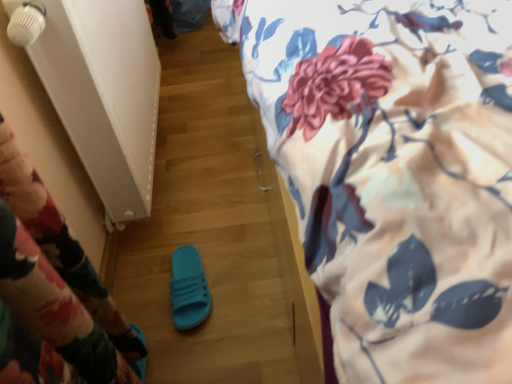
The height and width of the screenshot is (384, 512). Describe the element at coordinates (188, 289) in the screenshot. I see `teal rubber slipper at center` at that location.

Measure the distance between point (198, 324) and camera.

The distance of point (198, 324) from camera is 3.45 feet.

What is the approximate height of teal rubber slipper at center?

The height of teal rubber slipper at center is 5.65 centimeters.

Where is `teal rubber slipper at center`? This screenshot has width=512, height=384. teal rubber slipper at center is located at coordinates (188, 289).

The width and height of the screenshot is (512, 384). What do you see at coordinates (394, 173) in the screenshot? I see `floral fabric bed at upper right` at bounding box center [394, 173].

At what (x,y) coordinates should I click in order to perform the action: click on floral fabric bed at upper right. Please return your answer as a coordinate pair (x, y). The image size is (512, 384). Looking at the image, I should click on (394, 173).

Measure the distance between floral fabric bed at upper right and camera.

12.20 inches.

Find the location of a particular element. This screenshot has width=512, height=384. teal rubber slipper at center is located at coordinates (188, 289).

Can you confirm if floral fabric bed at upper right is positioned to the left of teal rubber slipper at center?

No.

Is floral fabric bed at upper right closer to the viewer compared to teal rubber slipper at center?

Yes, floral fabric bed at upper right is closer to the viewer.

Is point (323, 176) positioned in front of point (183, 250)?

Yes, point (323, 176) is in front of point (183, 250).

From the image's perspective, does floral fabric bed at upper right appear higher than teal rubber slipper at center?

Correct, floral fabric bed at upper right appears higher than teal rubber slipper at center in the image.

In the scene shown: From a real-world perspective, is floral fabric bed at upper right positioned above or below teal rubber slipper at center?

Clearly, from a real-world perspective, floral fabric bed at upper right is above teal rubber slipper at center.

Considering the sizes of floral fabric bed at upper right and teal rubber slipper at center in the image, is floral fabric bed at upper right wider or thinner than teal rubber slipper at center?

Clearly, floral fabric bed at upper right has more width compared to teal rubber slipper at center.

Considering the sizes of floral fabric bed at upper right and teal rubber slipper at center in the image, is floral fabric bed at upper right taller or shorter than teal rubber slipper at center?

floral fabric bed at upper right is taller than teal rubber slipper at center.

Who is smaller, floral fabric bed at upper right or teal rubber slipper at center?

With smaller size is teal rubber slipper at center.

Is floral fabric bed at upper right inside or outside of teal rubber slipper at center?

The correct answer is: outside.

Is floral fabric bed at upper right far from teal rubber slipper at center?

floral fabric bed at upper right is actually quite close to teal rubber slipper at center.

Is floral fabric bed at upper right oriented towards teal rubber slipper at center?

No, floral fabric bed at upper right does not turn towards teal rubber slipper at center.

Locate an element on the screen. This screenshot has width=512, height=384. bed located above the teal rubber slipper at center (from a real-world perspective) is located at coordinates (394, 173).

Would you say teal rubber slipper at center is to the left or to the right of floral fabric bed at upper right in the picture?

From the image, it's evident that teal rubber slipper at center is to the left of floral fabric bed at upper right.

Is teal rubber slipper at center in front of or behind floral fabric bed at upper right in the image?

teal rubber slipper at center is positioned farther from the viewer than floral fabric bed at upper right.

Considering the points (177, 267) and (421, 238), which point is in front, point (177, 267) or point (421, 238)?

The point (421, 238) is in front.

From the image's perspective, is teal rubber slipper at center located beneath floral fabric bed at upper right?

Yes.

From a real-world perspective, between teal rubber slipper at center and floral fabric bed at upper right, who is vertically lower?

teal rubber slipper at center.

Which of these two, teal rubber slipper at center or floral fabric bed at upper right, is thinner?

Thinner between the two is teal rubber slipper at center.

Looking at this image, can you confirm if teal rubber slipper at center is shorter than floral fabric bed at upper right?

Yes.

Which of these two, teal rubber slipper at center or floral fabric bed at upper right, is smaller?

teal rubber slipper at center.

In the scene shown: Is teal rubber slipper at center inside the boundaries of floral fabric bed at upper right, or outside?

teal rubber slipper at center lies outside floral fabric bed at upper right.

Would you say teal rubber slipper at center is a long distance from floral fabric bed at upper right?

That's not correct — teal rubber slipper at center is a little close to floral fabric bed at upper right.

Is teal rubber slipper at center facing towards floral fabric bed at upper right?

No, teal rubber slipper at center is not aimed at floral fabric bed at upper right.

What's the angular difference between teal rubber slipper at center and floral fabric bed at upper right's facing directions?

There is a 82.8-degree angle between the facing directions of teal rubber slipper at center and floral fabric bed at upper right.

Identify the location of footwear that is below the floral fabric bed at upper right (from the image's perspective). The width and height of the screenshot is (512, 384). (188, 289).

Locate an element on the screen. This screenshot has height=384, width=512. footwear below the floral fabric bed at upper right (from a real-world perspective) is located at coordinates (188, 289).

Locate an element on the screen. The image size is (512, 384). bed lying in front of the teal rubber slipper at center is located at coordinates (394, 173).